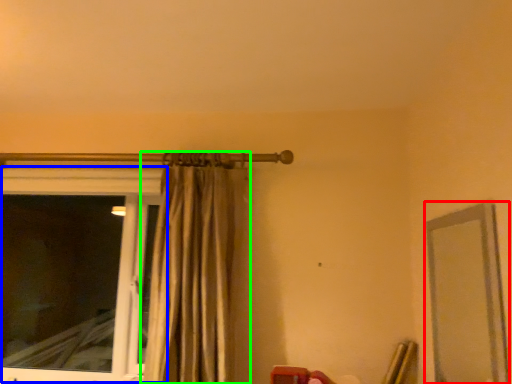
Question: Based on their relative distances, which object is farther from mirror (highlighted by a red box)? Choose from window (highlighted by a blue box) and curtain (highlighted by a green box).

Choices:
 (A) window
 (B) curtain

Answer: (A)